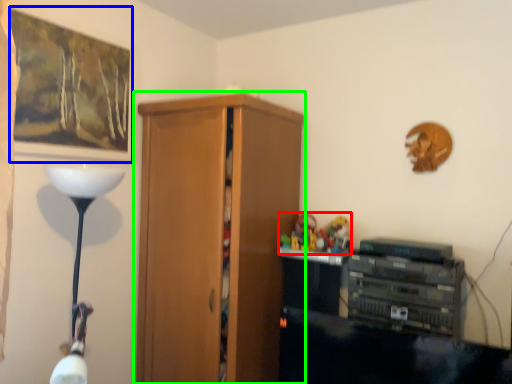
Question: Which object is positioned farthest from toy (highlighted by a red box)? Select from picture frame (highlighted by a blue box) and cupboard (highlighted by a green box).

Choices:
 (A) picture frame
 (B) cupboard

Answer: (A)